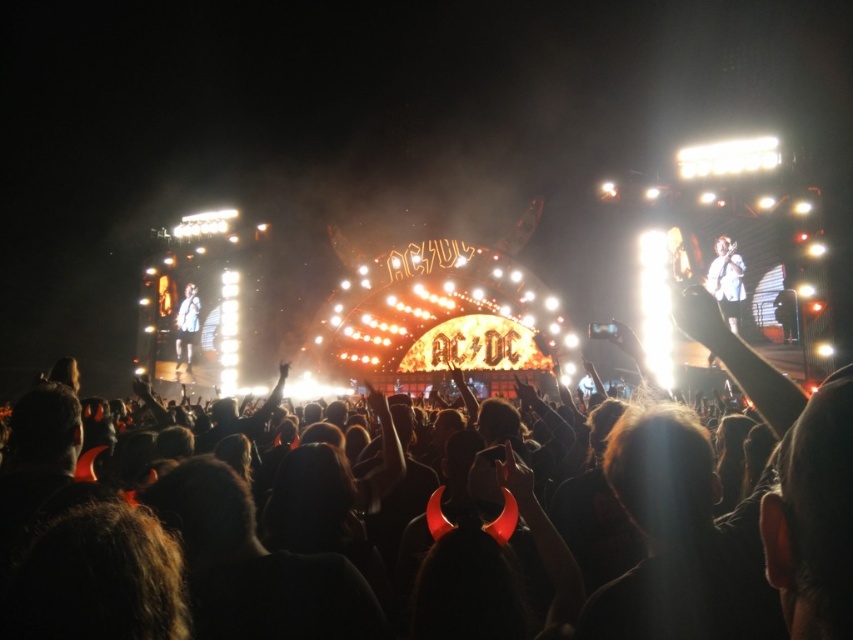
Who is lower down, white fabric shirt at upper right or white fabric shirt at left?

white fabric shirt at left is lower down.

Is white fabric shirt at upper right positioned in front of white fabric shirt at left?

Yes, white fabric shirt at upper right is closer to the viewer.

Which is behind, point (720, 300) or point (175, 346)?

The point (175, 346) is behind.

I want to click on white fabric shirt at upper right, so click(x=726, y=280).